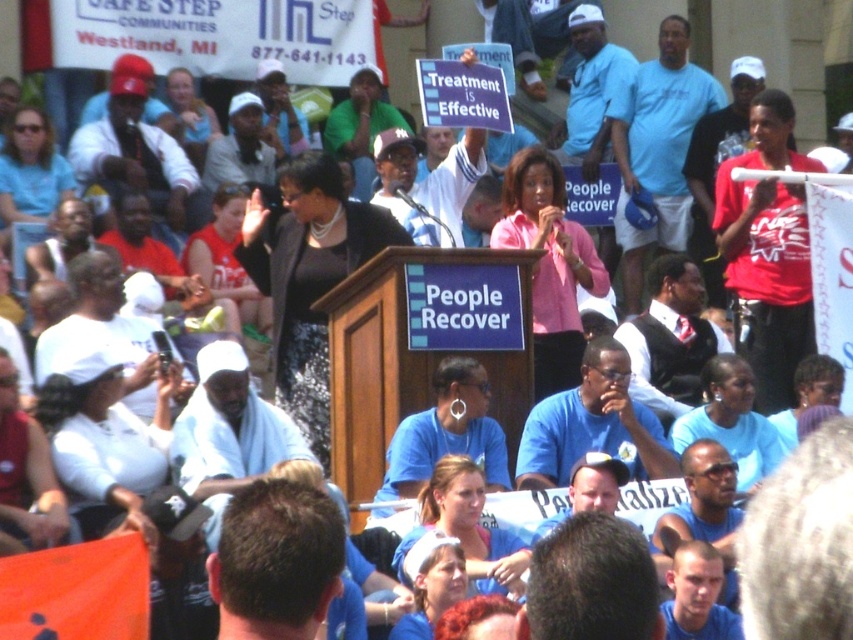
Question: Which point is closer to the camera taking this photo?

Choices:
 (A) (456, 492)
 (B) (463, 596)
 (C) (97, 483)
 (D) (576, 248)

Answer: (B)

Question: Estimate the real-world distances between objects in this image. Which object is farther from the matte blue shirt at lower center?

Choices:
 (A) light blue shirt at center
 (B) matte blue shirt at center
 (C) black sequined dress at center

Answer: (A)

Question: Does light blue shirt at center appear on the left side of matte blue shirt at lower center?

Choices:
 (A) no
 (B) yes

Answer: (A)

Question: Observing the image, what is the correct spatial positioning of black sequined dress at center in reference to pink fabric shirt at center?

Choices:
 (A) right
 (B) left

Answer: (B)

Question: Which object appears closest to the camera in this image?

Choices:
 (A) black sequined dress at center
 (B) pink fabric shirt at center
 (C) matte blue shirt at center

Answer: (C)

Question: Is pink fabric shirt at center further to camera compared to matte blue shirt at lower center?

Choices:
 (A) no
 (B) yes

Answer: (B)